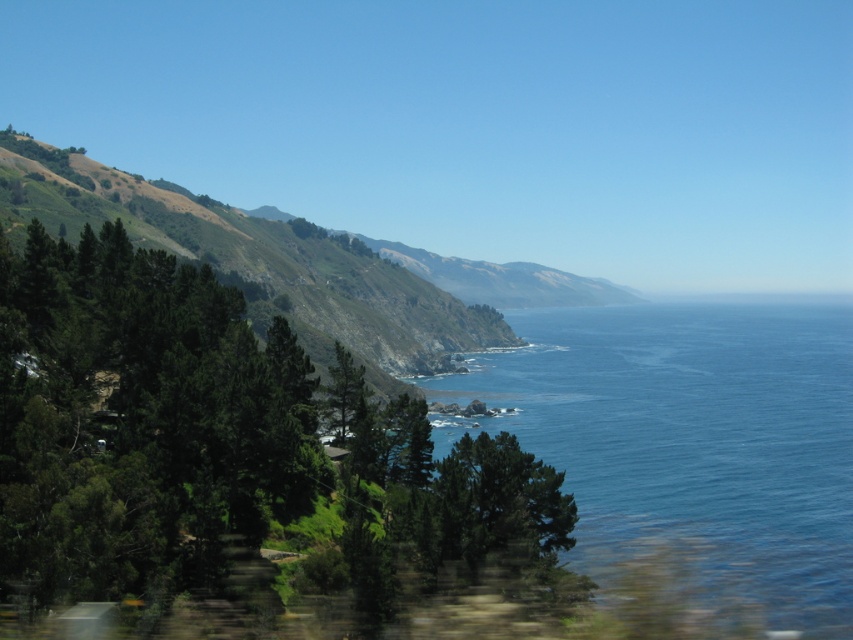
Question: Which point appears closest to the camera in this image?

Choices:
 (A) (10, 227)
 (B) (62, 600)
 (C) (506, 380)

Answer: (B)

Question: Can you confirm if green leafy tree at left is positioned to the right of blue liquid water at center?

Choices:
 (A) no
 (B) yes

Answer: (A)

Question: Can you confirm if green leafy tree at left is positioned to the right of green leafy hillside at left?

Choices:
 (A) no
 (B) yes

Answer: (B)

Question: Does green leafy tree at left appear on the right side of green leafy hillside at left?

Choices:
 (A) yes
 (B) no

Answer: (A)

Question: Which is nearer to the green leafy hillside at left?

Choices:
 (A) green leafy tree at left
 (B) blue liquid water at center

Answer: (B)

Question: Among these points, which one is nearest to the camera?

Choices:
 (A) (604, 408)
 (B) (450, 305)

Answer: (A)